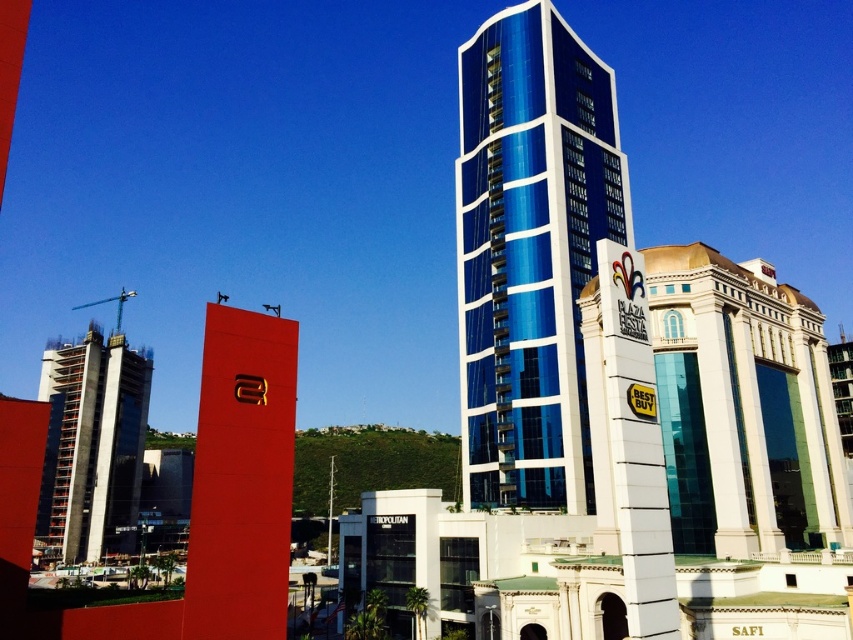
Can you confirm if blue glass building at center is shorter than dark gray concrete construction at left?

No.

Which is below, blue glass building at center or dark gray concrete construction at left?

dark gray concrete construction at left

Who is more distant from viewer, (554,292) or (59,472)?

The point (59,472) is behind.

Where is `blue glass building at center`? blue glass building at center is located at coordinates (531, 252).